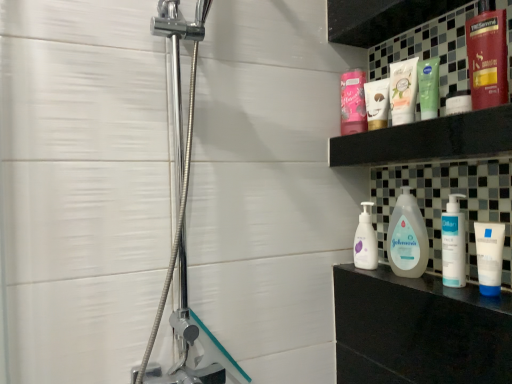
Question: Is shiny red hair conditioner at upper right, which is counted as the 6th toiletry, starting from the back, smaller than matte pink lotion at upper center, the second toiletry positioned from the back?

Choices:
 (A) no
 (B) yes

Answer: (A)

Question: Is shiny red hair conditioner at upper right, the 1th toiletry when ordered from front to back, placed right next to matte pink lotion at upper center, the second toiletry positioned from the back?

Choices:
 (A) no
 (B) yes

Answer: (A)

Question: From the image's perspective, would you say shiny red hair conditioner at upper right, the 1th toiletry when ordered from front to back, is positioned over matte pink lotion at upper center, the second toiletry positioned from the back?

Choices:
 (A) no
 (B) yes

Answer: (B)

Question: From a real-world perspective, is shiny red hair conditioner at upper right, which is counted as the 6th toiletry, starting from the back, positioned under matte pink lotion at upper center, the 5th toiletry in the front-to-back sequence, based on gravity?

Choices:
 (A) no
 (B) yes

Answer: (A)

Question: Is the position of shiny red hair conditioner at upper right, which is counted as the 6th toiletry, starting from the back, more distant than that of matte pink lotion at upper center, the 5th toiletry in the front-to-back sequence?

Choices:
 (A) no
 (B) yes

Answer: (A)

Question: From a real-world perspective, is shiny red hair conditioner at upper right, the 1th toiletry when ordered from front to back, on matte pink lotion at upper center, the second toiletry positioned from the back?

Choices:
 (A) yes
 (B) no

Answer: (A)

Question: Is the position of matte plastic bottles at upper right more distant than that of pink matte jar at upper center, which is the first toiletry in back-to-front order?

Choices:
 (A) yes
 (B) no

Answer: (B)

Question: Does matte plastic bottles at upper right have a lesser width compared to pink matte jar at upper center, which is the first toiletry in back-to-front order?

Choices:
 (A) yes
 (B) no

Answer: (B)

Question: Can you confirm if matte plastic bottles at upper right is bigger than pink matte jar at upper center, which is the first toiletry in back-to-front order?

Choices:
 (A) yes
 (B) no

Answer: (B)

Question: Could you tell me if matte plastic bottles at upper right is turned towards pink matte jar at upper center, the 6th toiletry positioned from the front?

Choices:
 (A) no
 (B) yes

Answer: (A)

Question: Can you confirm if matte plastic bottles at upper right is smaller than pink matte jar at upper center, which is the first toiletry in back-to-front order?

Choices:
 (A) no
 (B) yes

Answer: (B)

Question: From a real-world perspective, is matte plastic bottles at upper right located higher than pink matte jar at upper center, the 6th toiletry positioned from the front?

Choices:
 (A) yes
 (B) no

Answer: (B)

Question: Can you confirm if white pump bottle at right, which is counted as the third toiletry, starting from the front, is thinner than green matte lotion at upper center, the 4th toiletry viewed from the front?

Choices:
 (A) no
 (B) yes

Answer: (B)